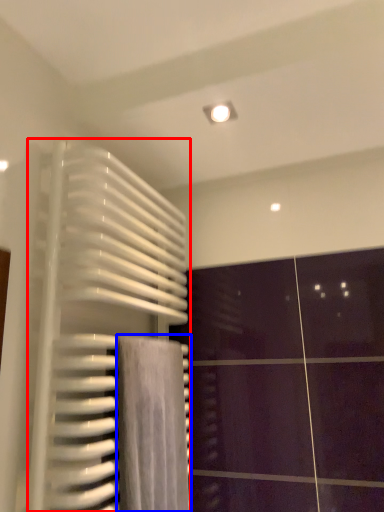
Question: Which of the following is the farthest to the observer, radiator (highlighted by a red box) or bath towel (highlighted by a blue box)?

Choices:
 (A) radiator
 (B) bath towel

Answer: (B)